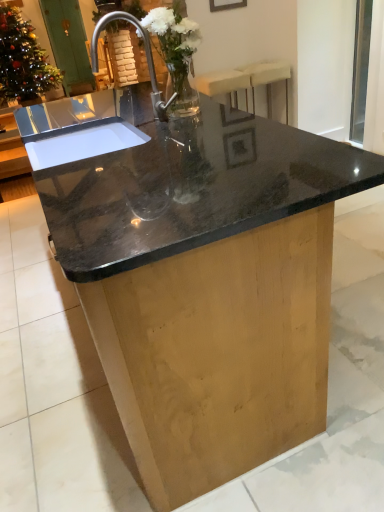
Question: Considering the relative sizes of clear glass vase at center, the second floral arrangement viewed from the top, and matte black picture frame at upper center in the image provided, is clear glass vase at center, the second floral arrangement viewed from the top, taller than matte black picture frame at upper center?

Choices:
 (A) yes
 (B) no

Answer: (A)

Question: Is matte black picture frame at upper center completely or partially inside clear glass vase at center, positioned as the 1th floral arrangement in front-to-back order?

Choices:
 (A) yes
 (B) no

Answer: (B)

Question: Can you confirm if clear glass vase at center, which is counted as the 1th floral arrangement, starting from the right, is shorter than matte black picture frame at upper center?

Choices:
 (A) yes
 (B) no

Answer: (B)

Question: From a real-world perspective, is clear glass vase at center, the second floral arrangement viewed from the top, beneath matte black picture frame at upper center?

Choices:
 (A) no
 (B) yes

Answer: (B)

Question: Is there a large distance between clear glass vase at center, positioned as the 1th floral arrangement in front-to-back order, and matte black picture frame at upper center?

Choices:
 (A) yes
 (B) no

Answer: (A)

Question: From a real-world perspective, is green wooden screen door at upper left positioned above or below matte black picture frame at upper center?

Choices:
 (A) above
 (B) below

Answer: (B)

Question: Would you say green wooden screen door at upper left is inside or outside matte black picture frame at upper center?

Choices:
 (A) inside
 (B) outside

Answer: (B)

Question: In terms of width, does green wooden screen door at upper left look wider or thinner when compared to matte black picture frame at upper center?

Choices:
 (A) thin
 (B) wide

Answer: (B)

Question: Is green wooden screen door at upper left bigger or smaller than matte black picture frame at upper center?

Choices:
 (A) big
 (B) small

Answer: (A)

Question: Considering their positions, is green wooden screen door at upper left located in front of or behind translucent glass vase at upper left, which is the second floral arrangement in bottom-to-top order?

Choices:
 (A) behind
 (B) front

Answer: (A)

Question: Does point (76, 79) appear closer or farther from the camera than point (31, 71)?

Choices:
 (A) closer
 (B) farther

Answer: (B)

Question: In terms of height, does green wooden screen door at upper left look taller or shorter compared to translucent glass vase at upper left, which is counted as the first floral arrangement, starting from the back?

Choices:
 (A) tall
 (B) short

Answer: (B)

Question: From a real-world perspective, is green wooden screen door at upper left positioned above or below translucent glass vase at upper left, which appears as the first floral arrangement when viewed from the left?

Choices:
 (A) above
 (B) below

Answer: (B)

Question: Considering the positions of translucent glass vase at upper left, which appears as the first floral arrangement when viewed from the left, and transparent glass window screen at upper right in the image, is translucent glass vase at upper left, which appears as the first floral arrangement when viewed from the left, taller or shorter than transparent glass window screen at upper right?

Choices:
 (A) short
 (B) tall

Answer: (B)

Question: From the image's perspective, is translucent glass vase at upper left, placed as the 2th floral arrangement when sorted from front to back, positioned above or below transparent glass window screen at upper right?

Choices:
 (A) below
 (B) above

Answer: (B)